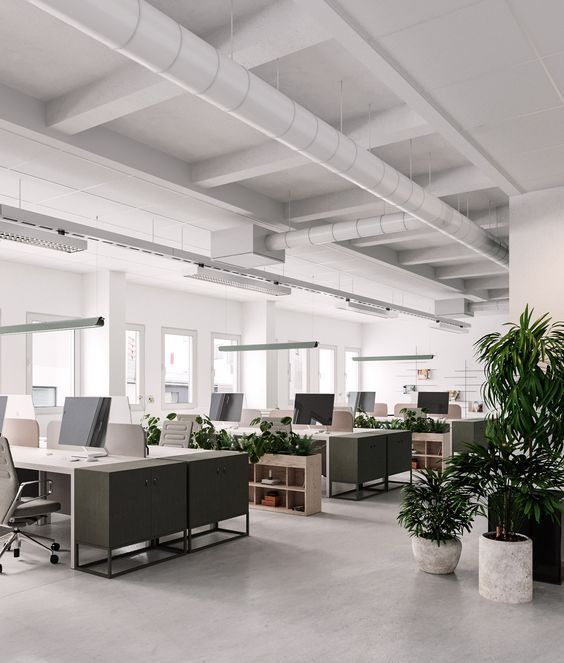
Identify the location of wall design. (470, 369), (470, 376), (471, 383), (471, 390), (471, 398), (435, 369), (416, 361), (412, 374), (425, 387), (407, 390).